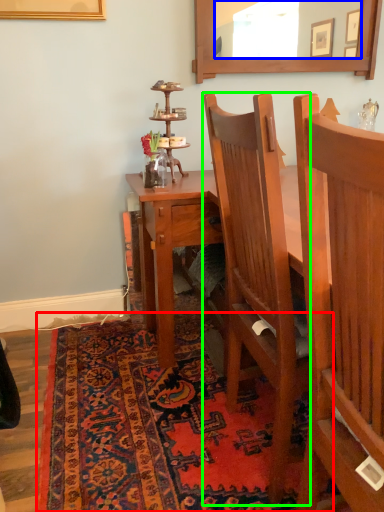
Question: Which object is the farthest from mat (highlighted by a red box)? Choose among these: mirror (highlighted by a blue box) or chair (highlighted by a green box).

Choices:
 (A) mirror
 (B) chair

Answer: (A)